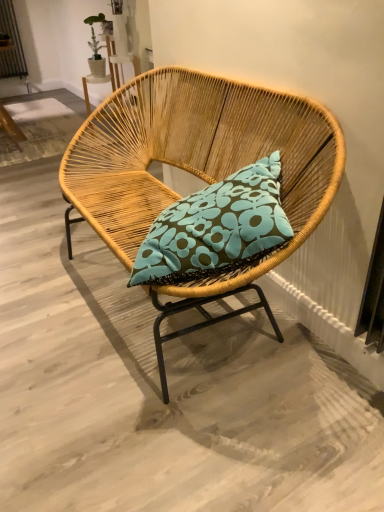
Consider the image. In order to face teal fabric pillow at center, should I rotate leftwards or rightwards?

Rotate your view right by about 2.794°.

What do you see at coordinates (216, 228) in the screenshot? I see `teal fabric pillow at center` at bounding box center [216, 228].

The image size is (384, 512). I want to click on teal fabric pillow at center, so click(216, 228).

Measure the distance between woven wood chair at center and camera.

3.32 feet.

Describe the element at coordinates (197, 170) in the screenshot. I see `woven wood chair at center` at that location.

At what (x,y) coordinates should I click in order to perform the action: click on woven wood chair at center. Please return your answer as a coordinate pair (x, y). Looking at the image, I should click on (197, 170).

At what (x,y) coordinates should I click in order to perform the action: click on teal fabric pillow at center. Please return your answer as a coordinate pair (x, y). Looking at the image, I should click on (216, 228).

Which object is positioned more to the right, teal fabric pillow at center or woven wood chair at center?

teal fabric pillow at center.

Is teal fabric pillow at center closer to camera compared to woven wood chair at center?

No, teal fabric pillow at center is further to the viewer.

Which point is more forward, (186,248) or (79,190)?

Positioned in front is point (186,248).

Consider the image. From the image's perspective, which one is positioned lower, teal fabric pillow at center or woven wood chair at center?

teal fabric pillow at center, from the image's perspective.

From a real-world perspective, between teal fabric pillow at center and woven wood chair at center, who is vertically higher?

teal fabric pillow at center is physically above.

Looking at this image, considering the relative sizes of teal fabric pillow at center and woven wood chair at center in the image provided, is teal fabric pillow at center wider than woven wood chair at center?

Incorrect, the width of teal fabric pillow at center does not surpass that of woven wood chair at center.

Based on the photo, between teal fabric pillow at center and woven wood chair at center, which one has less height?

teal fabric pillow at center is shorter.

From the picture: Who is bigger, teal fabric pillow at center or woven wood chair at center?

woven wood chair at center is bigger.

Is teal fabric pillow at center completely or partially outside of woven wood chair at center?

No, teal fabric pillow at center is not entirely external to woven wood chair at center.

From the picture: Would you consider teal fabric pillow at center to be distant from woven wood chair at center?

No, teal fabric pillow at center is not far from woven wood chair at center.

Is teal fabric pillow at center oriented away from woven wood chair at center?

That's right, teal fabric pillow at center is facing away from woven wood chair at center.

Locate an element on the screen. Image resolution: width=384 pixels, height=512 pixels. pillow above the woven wood chair at center (from a real-world perspective) is located at coordinates (216, 228).

Which is more to the left, woven wood chair at center or teal fabric pillow at center?

woven wood chair at center.

Does woven wood chair at center come in front of teal fabric pillow at center?

Yes, woven wood chair at center is closer to the viewer.

Does point (233, 113) lie in front of point (232, 176)?

No.

From the image's perspective, which one is positioned higher, woven wood chair at center or teal fabric pillow at center?

woven wood chair at center appears higher in the image.

From a real-world perspective, which object stands above the other?

teal fabric pillow at center is physically above.

Which object is wider, woven wood chair at center or teal fabric pillow at center?

woven wood chair at center.

Is woven wood chair at center taller or shorter than teal fabric pillow at center?

woven wood chair at center is taller than teal fabric pillow at center.

Can you confirm if woven wood chair at center is bigger than teal fabric pillow at center?

Correct, woven wood chair at center is larger in size than teal fabric pillow at center.

Is teal fabric pillow at center located within woven wood chair at center?

Yes, teal fabric pillow at center is surrounded by woven wood chair at center.

Is woven wood chair at center next to teal fabric pillow at center?

No, woven wood chair at center is not beside teal fabric pillow at center.

Is woven wood chair at center looking in the opposite direction of teal fabric pillow at center?

Yes.

How different are the orientations of woven wood chair at center and teal fabric pillow at center in degrees?

There is a 39.2-degree angle between the facing directions of woven wood chair at center and teal fabric pillow at center.

How much distance is there between woven wood chair at center and teal fabric pillow at center?

A distance of 10.52 inches exists between woven wood chair at center and teal fabric pillow at center.

The width and height of the screenshot is (384, 512). Identify the location of chair below the teal fabric pillow at center (from a real-world perspective). (197, 170).

In the image, there is a teal fabric pillow at center. At what (x,y) coordinates should I click in order to perform the action: click on chair below it (from a real-world perspective). Please return your answer as a coordinate pair (x, y). This screenshot has width=384, height=512. Looking at the image, I should click on (197, 170).

This screenshot has width=384, height=512. I want to click on pillow on the right of woven wood chair at center, so click(216, 228).